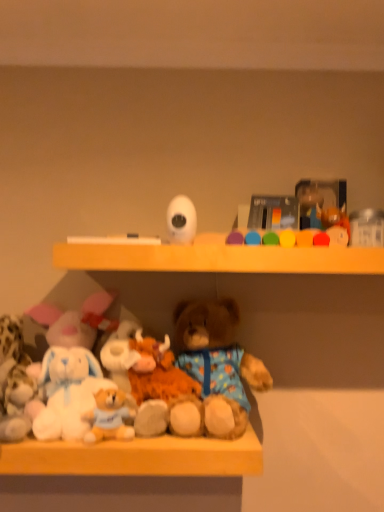
Question: Considering the positions of white matte camera at upper center, positioned as the second toy in right-to-left order, and fluffy white stuffed animal at lower left, acting as the first toy starting from the left, in the image, is white matte camera at upper center, positioned as the second toy in right-to-left order, wider or thinner than fluffy white stuffed animal at lower left, acting as the first toy starting from the left,?

Choices:
 (A) wide
 (B) thin

Answer: (B)

Question: From a real-world perspective, relative to fluffy white stuffed animal at lower left, the third toy from the top, is white matte camera at upper center, which ranks as the 3th toy in left-to-right order, vertically above or below?

Choices:
 (A) below
 (B) above

Answer: (B)

Question: Estimate the real-world distances between objects in this image. Which object is closer to the fluffy beige teddy bear at lower left, the fourth toy positioned from the top?

Choices:
 (A) fluffy white stuffed animal at lower left, the third toy from the top
 (B) white plush toys at lower center
 (C) glossy plastic toy at upper center, which is the first toy in right-to-left order
 (D) white matte camera at upper center, which ranks as the 3th toy in left-to-right order
 (E) fluffy brown teddy bear at center

Answer: (A)

Question: Estimate the real-world distances between objects in this image. Which object is farther from the white plush toys at lower center?

Choices:
 (A) white matte camera at upper center, which ranks as the 3th toy in left-to-right order
 (B) fluffy brown teddy bear at center
 (C) fluffy beige teddy bear at lower left, which is the first toy from bottom to top
 (D) fluffy white stuffed animal at lower left, the third toy from the top
 (E) glossy plastic toy at upper center, which is the first toy in right-to-left order

Answer: (E)